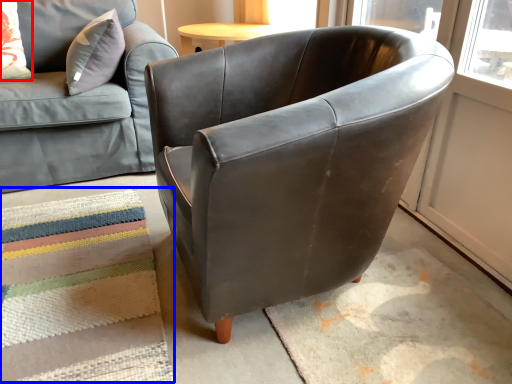
Question: Which of the following is the farthest to the observer, pillow (highlighted by a red box) or mat (highlighted by a blue box)?

Choices:
 (A) pillow
 (B) mat

Answer: (A)